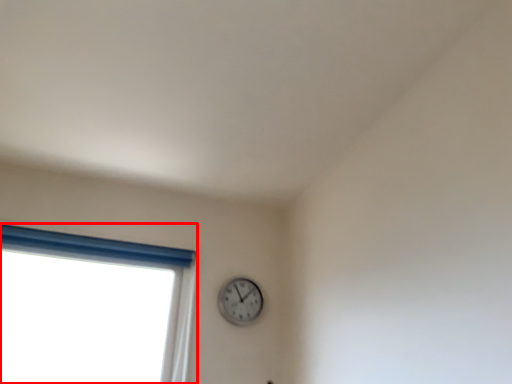
Question: Where is window (annotated by the red box) located in relation to wall clock in the image?

Choices:
 (A) left
 (B) right

Answer: (A)